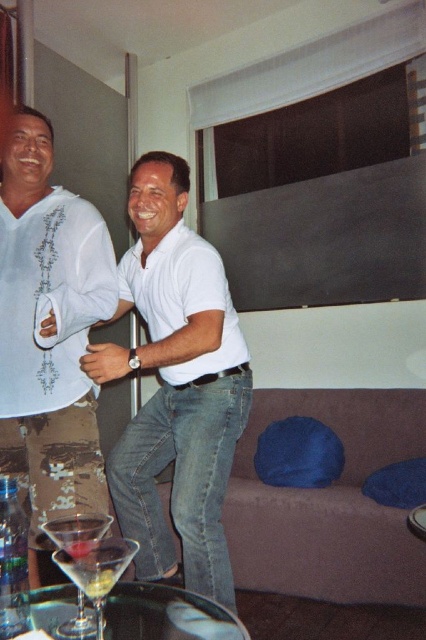
Question: Can you confirm if white matte shirt at center is smaller than white embroidered shirt at left?

Choices:
 (A) yes
 (B) no

Answer: (B)

Question: Estimate the real-world distances between objects in this image. Which object is farther from the brown suede couch at lower center?

Choices:
 (A) white embroidered shirt at left
 (B) transparent glass table at lower center
 (C) white matte shirt at center

Answer: (A)

Question: In this image, where is brown suede couch at lower center located relative to transparent glass table at lower center?

Choices:
 (A) above
 (B) below

Answer: (A)

Question: Does transparent glass table at lower center have a greater width compared to clear glass wine glass at lower left?

Choices:
 (A) yes
 (B) no

Answer: (A)

Question: Based on their relative distances, which object is nearer to the white matte shirt at center?

Choices:
 (A) brown suede couch at lower center
 (B) white embroidered shirt at left
 (C) transparent glass table at lower center
 (D) clear glass wine glass at lower left

Answer: (B)

Question: Which point appears closest to the camera in this image?

Choices:
 (A) (166, 586)
 (B) (348, 540)
 (C) (203, 408)
 (D) (31, 269)

Answer: (D)